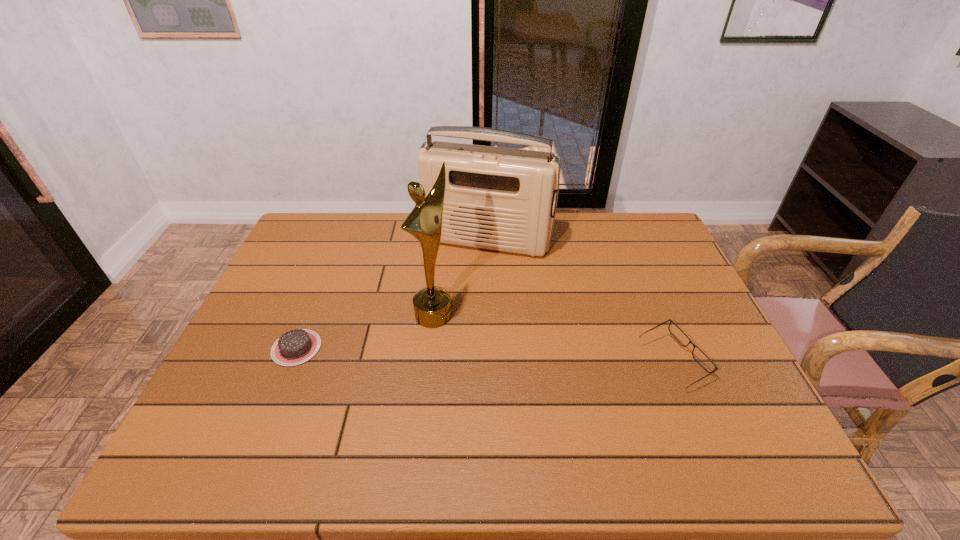
Locate an element on the screen. Image resolution: width=960 pixels, height=540 pixels. the shortest object is located at coordinates (294, 347).

Where is `the leftmost object`? The height and width of the screenshot is (540, 960). the leftmost object is located at coordinates (294, 347).

This screenshot has width=960, height=540. I want to click on the rightmost object, so click(704, 361).

The width and height of the screenshot is (960, 540). What are the coordinates of `the second shortest object` in the screenshot? It's located at (704, 361).

The image size is (960, 540). What are the coordinates of `award` in the screenshot? It's located at (432, 307).

Find the location of a particular element. Image resolution: width=960 pixels, height=540 pixels. radio receiver is located at coordinates (496, 198).

The width and height of the screenshot is (960, 540). What are the coordinates of `vacant space located 0.200m on the back of the shortest object` in the screenshot? It's located at (324, 280).

You are a GUI agent. You are given a task and a screenshot of the screen. Output one action in this format:
    pyautogui.click(x=<x>, y=<y>)
    Task: Click on the vacant space located 0.050m with the lenses facing outward on the rightmost object
    The image size is (960, 540).
    Given the screenshot: What is the action you would take?
    pyautogui.click(x=726, y=362)

At what (x,y) coordinates should I click in order to perform the action: click on vacant area situated 0.280m on the front-facing side of the award. Please return your answer as a coordinate pair (x, y). The width and height of the screenshot is (960, 540). Looking at the image, I should click on (538, 378).

Locate an element on the screen. The image size is (960, 540). free region located on the front-facing side of the award is located at coordinates (523, 369).